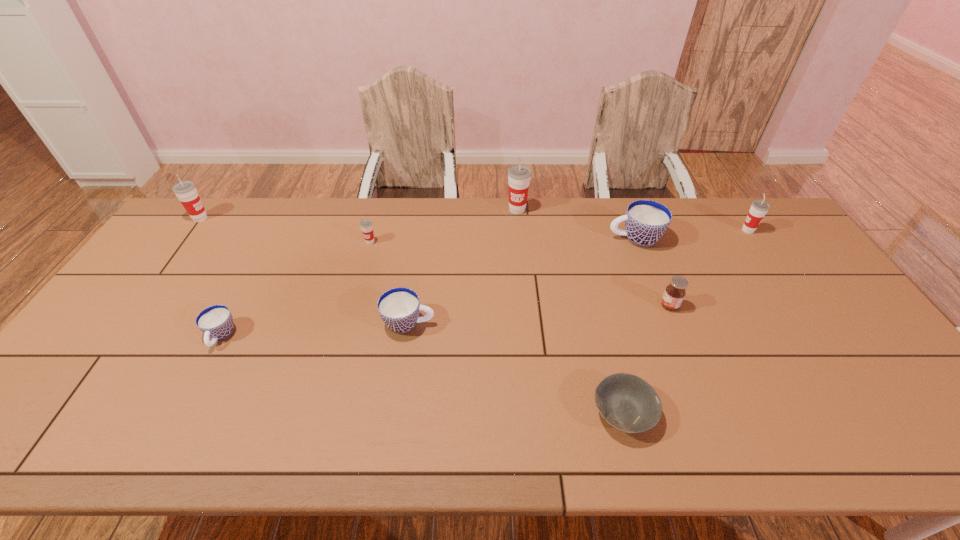
Find the location of `vacant space in between the nearest red cup and the leftmost red cup`. vacant space in between the nearest red cup and the leftmost red cup is located at coordinates [x=285, y=230].

The height and width of the screenshot is (540, 960). I want to click on vacant area that lies between the seventh shortest object and the jam, so click(x=708, y=268).

Where is `object that stands as the seventh closest to the tallest cup`? The width and height of the screenshot is (960, 540). object that stands as the seventh closest to the tallest cup is located at coordinates (216, 322).

The image size is (960, 540). Find the location of `the third closest object to the fifth cup from left to right`. the third closest object to the fifth cup from left to right is located at coordinates (399, 307).

Locate an element on the screen. the third closest cup to the gray bowl is located at coordinates (519, 176).

Select which cup is the fourth closest to the second biggest red cup. Please provide its 2D coordinates. Your answer should be formatted as a tuple, i.e. [(x, y)], where the tuple contains the x and y coordinates of a point satisfying the conditions above.

[(519, 176)]

Locate an element on the screen. the third closest red cup to the third tallest object is located at coordinates (186, 191).

Select which red cup appears as the closest to the second red cup from right to left. Please provide its 2D coordinates. Your answer should be formatted as a tuple, i.e. [(x, y)], where the tuple contains the x and y coordinates of a point satisfying the conditions above.

[(366, 225)]

This screenshot has height=540, width=960. Identify the location of blue cup that stands as the closest to the leftmost red cup. (216, 322).

This screenshot has height=540, width=960. I want to click on the closest blue cup to the gray bowl, so click(399, 307).